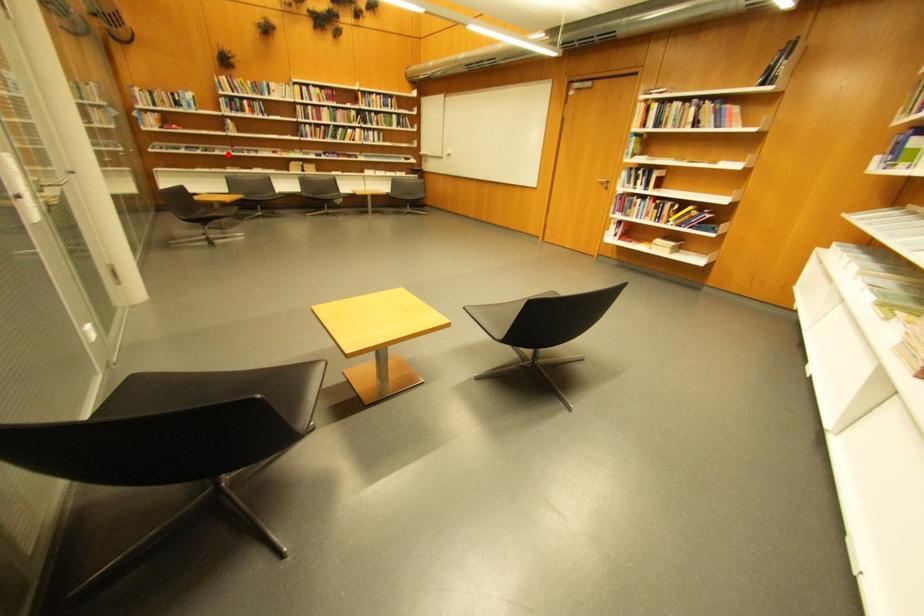
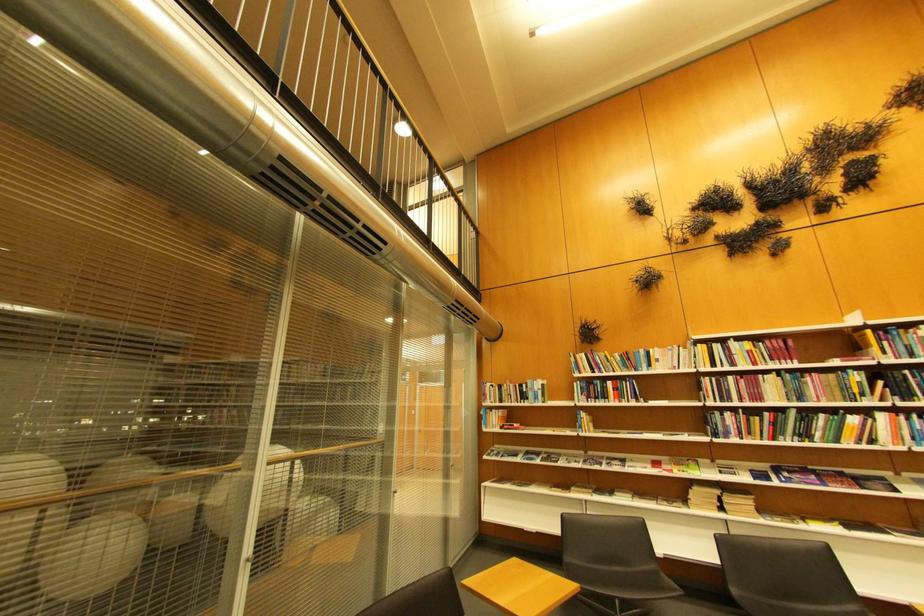
Find the pixel in the second image that matches the highlighted location in the first image.

(572, 464)